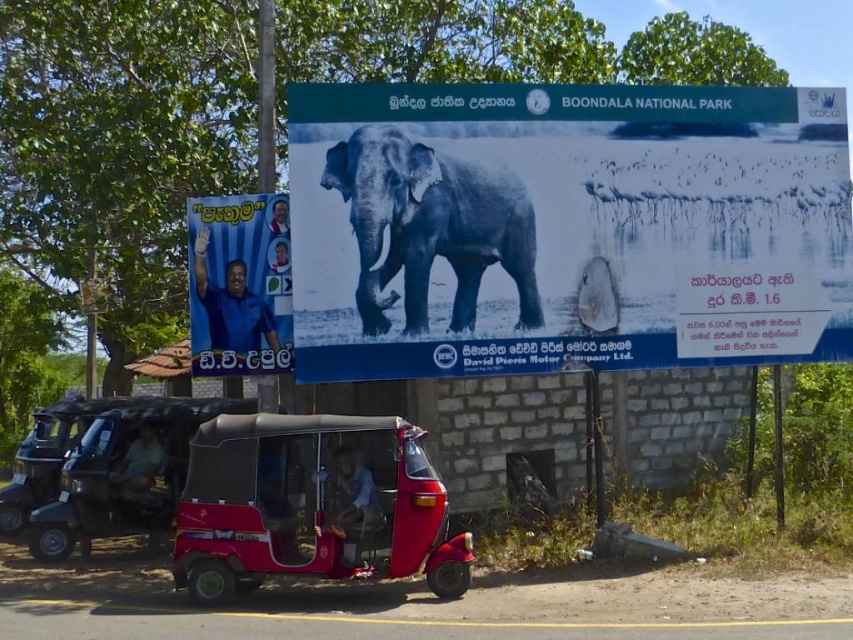
Is black and white elephant at center positioned in front of shiny red tuk-tuk at center?

No, black and white elephant at center is further to the viewer.

Looking at this image, can you confirm if black and white elephant at center is smaller than shiny red tuk-tuk at center?

Indeed, black and white elephant at center has a smaller size compared to shiny red tuk-tuk at center.

The height and width of the screenshot is (640, 853). Describe the element at coordinates (566, 227) in the screenshot. I see `black and white elephant at center` at that location.

What are the coordinates of `black and white elephant at center` in the screenshot? It's located at (566, 227).

Is shiny red tuk-tuk at center taller than gray textured elephant at center?

Incorrect, shiny red tuk-tuk at center's height is not larger of gray textured elephant at center's.

From the picture: Who is more forward, (306, 422) or (450, 246)?

Point (306, 422)

Who is more distant from viewer, (x=270, y=483) or (x=480, y=269)?

The point (x=480, y=269) is more distant.

This screenshot has height=640, width=853. I want to click on shiny red tuk-tuk at center, so click(312, 506).

The height and width of the screenshot is (640, 853). Describe the element at coordinates (566, 227) in the screenshot. I see `black and white elephant at center` at that location.

Does black and white elephant at center appear on the right side of gray textured elephant at center?

Indeed, black and white elephant at center is positioned on the right side of gray textured elephant at center.

Does point (572, 128) lie behind point (456, 250)?

Yes, it is.

The height and width of the screenshot is (640, 853). Identify the location of black and white elephant at center. (566, 227).